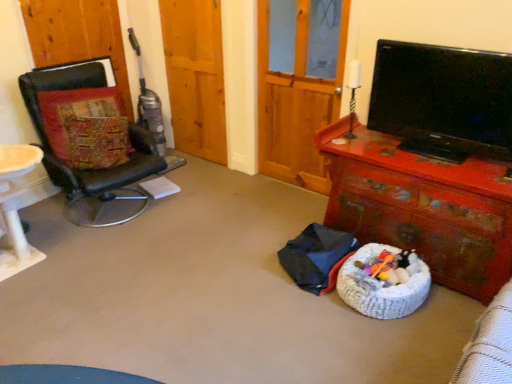
Identify the location of vacant space in between dark blue fabric at center and white woven dog bed at lower center. (353, 311).